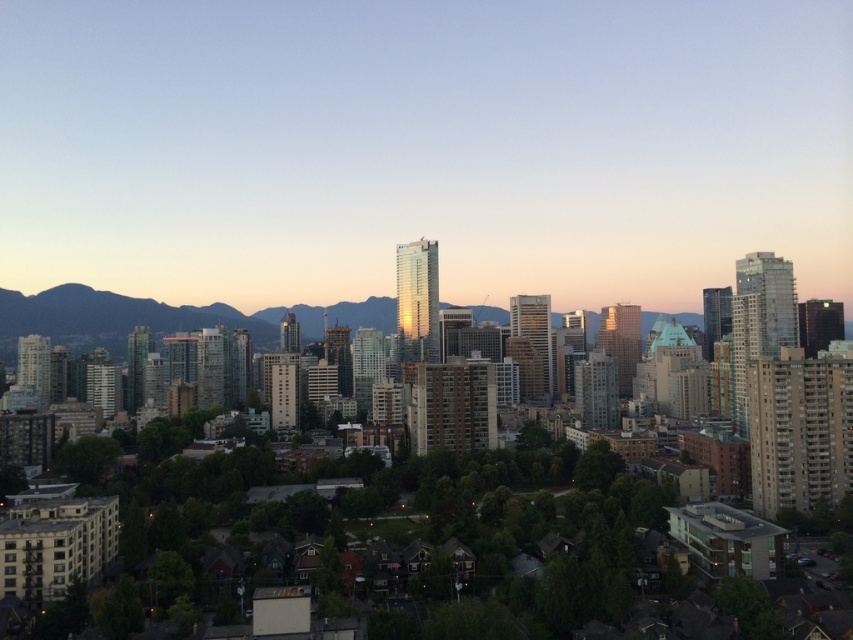
Between point (798, 198) and point (114, 336), which one is positioned behind?

Positioned behind is point (798, 198).

Between matte glass skyscraper at center and rocky brown mountain at center, which one is positioned lower?

rocky brown mountain at center is lower down.

The image size is (853, 640). In order to click on matte glass skyscraper at center in this screenshot , I will do `click(422, 147)`.